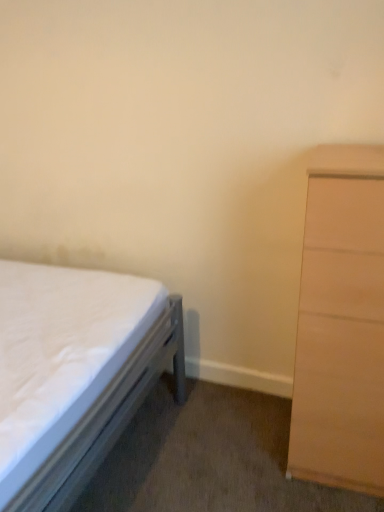
The width and height of the screenshot is (384, 512). What do you see at coordinates (75, 373) in the screenshot? I see `white fabric bed at left` at bounding box center [75, 373].

I want to click on white fabric bed at left, so click(x=75, y=373).

Describe the element at coordinates (341, 324) in the screenshot. I see `light brown wood chest of drawers at right` at that location.

Locate an element on the screen. The height and width of the screenshot is (512, 384). light brown wood chest of drawers at right is located at coordinates (341, 324).

Measure the distance between point (322, 440) and camera.

4.32 feet.

I want to click on white fabric bed at left, so click(75, 373).

Is white fabric bed at left at the right side of light brown wood chest of drawers at right?

In fact, white fabric bed at left is to the left of light brown wood chest of drawers at right.

Is white fabric bed at left closer to camera compared to light brown wood chest of drawers at right?

That is True.

Is point (87, 354) closer or farther from the camera than point (317, 398)?

Point (87, 354) is closer to the camera than point (317, 398).

Looking at this image, from the image's perspective, which one is positioned lower, white fabric bed at left or light brown wood chest of drawers at right?

white fabric bed at left is shown below in the image.

From a real-world perspective, is white fabric bed at left on light brown wood chest of drawers at right?

No, from a real-world perspective, white fabric bed at left is not over light brown wood chest of drawers at right

Can you confirm if white fabric bed at left is wider than light brown wood chest of drawers at right?

Yes, white fabric bed at left is wider than light brown wood chest of drawers at right.

Considering the sizes of white fabric bed at left and light brown wood chest of drawers at right in the image, is white fabric bed at left taller or shorter than light brown wood chest of drawers at right?

Clearly, white fabric bed at left is shorter compared to light brown wood chest of drawers at right.

In the scene shown: Between white fabric bed at left and light brown wood chest of drawers at right, which one has larger size?

white fabric bed at left.

Could light brown wood chest of drawers at right be considered to be inside white fabric bed at left?

No, white fabric bed at left does not contain light brown wood chest of drawers at right.

Is there a large distance between white fabric bed at left and light brown wood chest of drawers at right?

No, white fabric bed at left is in close proximity to light brown wood chest of drawers at right.

Is light brown wood chest of drawers at right at the back of white fabric bed at left?

That's not correct — white fabric bed at left is not looking away from light brown wood chest of drawers at right.

Find the location of a particular element. This screenshot has height=512, width=384. bed located in front of the light brown wood chest of drawers at right is located at coordinates (75, 373).

Can you confirm if light brown wood chest of drawers at right is positioned to the left of white fabric bed at left?

In fact, light brown wood chest of drawers at right is to the right of white fabric bed at left.

Is the depth of light brown wood chest of drawers at right less than that of white fabric bed at left?

That is False.

Between point (301, 451) and point (46, 300), which one is positioned in front?

The point (301, 451) is closer.

From the image's perspective, who appears lower, light brown wood chest of drawers at right or white fabric bed at left?

From the image's view, white fabric bed at left is below.

From a real-world perspective, which is physically above, light brown wood chest of drawers at right or white fabric bed at left?

From a 3D spatial view, light brown wood chest of drawers at right is above.

Is light brown wood chest of drawers at right wider than white fabric bed at left?

No.

Considering the sizes of light brown wood chest of drawers at right and white fabric bed at left in the image, is light brown wood chest of drawers at right taller or shorter than white fabric bed at left?

Clearly, light brown wood chest of drawers at right is taller compared to white fabric bed at left.

Looking at this image, considering the sizes of light brown wood chest of drawers at right and white fabric bed at left in the image, is light brown wood chest of drawers at right bigger or smaller than white fabric bed at left?

light brown wood chest of drawers at right is smaller than white fabric bed at left.

Is light brown wood chest of drawers at right inside the boundaries of white fabric bed at left, or outside?

light brown wood chest of drawers at right cannot be found inside white fabric bed at left.

Is light brown wood chest of drawers at right far from white fabric bed at left?

light brown wood chest of drawers at right is actually quite close to white fabric bed at left.

Is light brown wood chest of drawers at right aimed at white fabric bed at left?

No, light brown wood chest of drawers at right is not oriented towards white fabric bed at left.

How far apart are light brown wood chest of drawers at right and white fabric bed at left?

The distance of light brown wood chest of drawers at right from white fabric bed at left is 27.34 inches.

At what (x,y) coordinates should I click in order to perform the action: click on bed lying below the light brown wood chest of drawers at right (from the image's perspective). Please return your answer as a coordinate pair (x, y). This screenshot has height=512, width=384. Looking at the image, I should click on (75, 373).

In order to click on bed lying in front of the light brown wood chest of drawers at right in this screenshot , I will do `click(75, 373)`.

I want to click on bed below the light brown wood chest of drawers at right (from the image's perspective), so click(x=75, y=373).